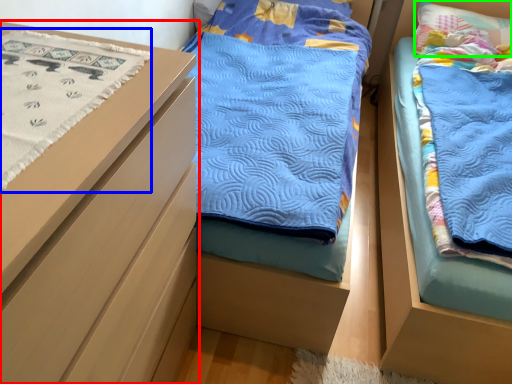
Question: Which is farther away from chest of drawers (highlighted by a red box)? blanket (highlighted by a blue box) or pillow (highlighted by a green box)?

Choices:
 (A) blanket
 (B) pillow

Answer: (B)